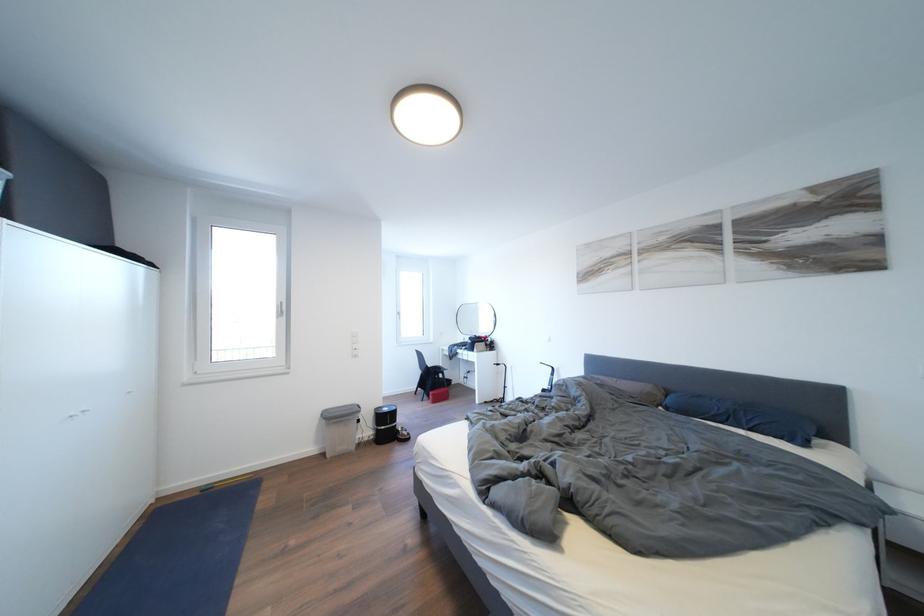
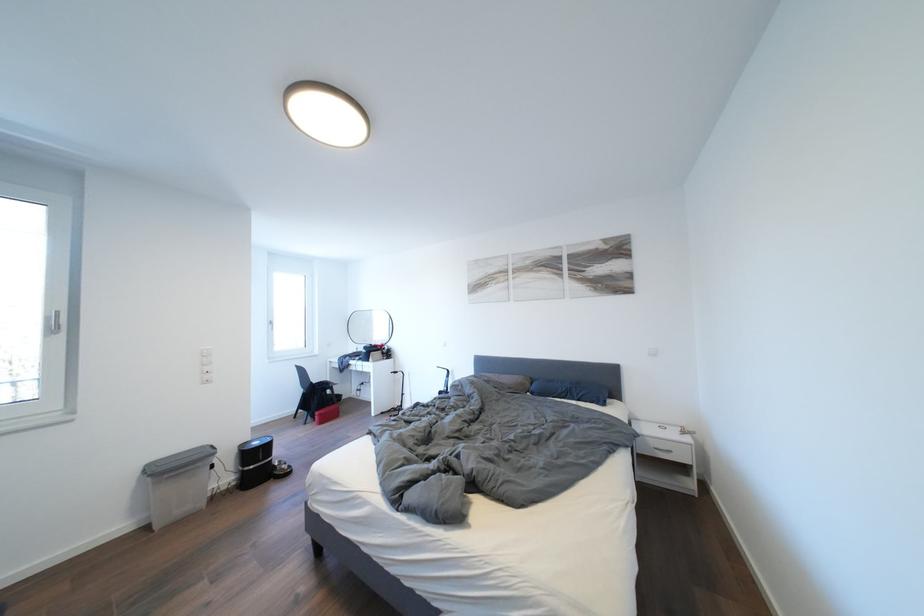
The point at (676,406) is marked in the first image. Where is the corresponding point in the second image?

(541, 392)